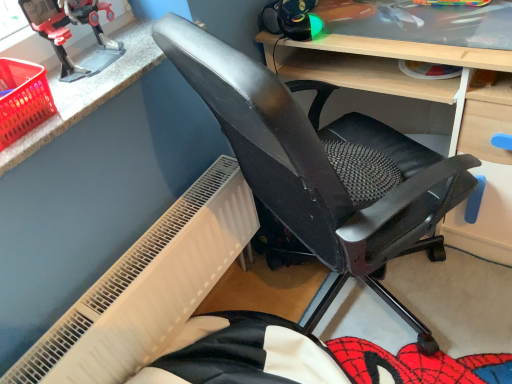
Question: Is metallic plastic toy robot at upper left facing away from white textured radiator at lower left?

Choices:
 (A) yes
 (B) no

Answer: (B)

Question: Are metallic plastic toy robot at upper left and white textured radiator at lower left far apart?

Choices:
 (A) no
 (B) yes

Answer: (A)

Question: Is metallic plastic toy robot at upper left smaller than white textured radiator at lower left?

Choices:
 (A) yes
 (B) no

Answer: (A)

Question: Is white textured radiator at lower left completely or partially inside metallic plastic toy robot at upper left?

Choices:
 (A) no
 (B) yes

Answer: (A)

Question: Can you confirm if metallic plastic toy robot at upper left is shorter than white textured radiator at lower left?

Choices:
 (A) no
 (B) yes

Answer: (B)

Question: From a real-world perspective, is metallic plastic toy robot at upper left physically below white textured radiator at lower left?

Choices:
 (A) no
 (B) yes

Answer: (A)

Question: Is black mesh chair at center shorter than white textured radiator at lower left?

Choices:
 (A) no
 (B) yes

Answer: (A)

Question: Is the position of black mesh chair at center more distant than that of white textured radiator at lower left?

Choices:
 (A) yes
 (B) no

Answer: (B)

Question: Is black mesh chair at center positioned before white textured radiator at lower left?

Choices:
 (A) no
 (B) yes

Answer: (B)

Question: Is black mesh chair at center located outside white textured radiator at lower left?

Choices:
 (A) yes
 (B) no

Answer: (A)

Question: Does black mesh chair at center have a greater height compared to white textured radiator at lower left?

Choices:
 (A) yes
 (B) no

Answer: (A)

Question: From a real-world perspective, is black mesh chair at center located higher than white textured radiator at lower left?

Choices:
 (A) no
 (B) yes

Answer: (B)

Question: Does black mesh chair at center have a lesser height compared to metallic plastic toy robot at upper left?

Choices:
 (A) yes
 (B) no

Answer: (B)